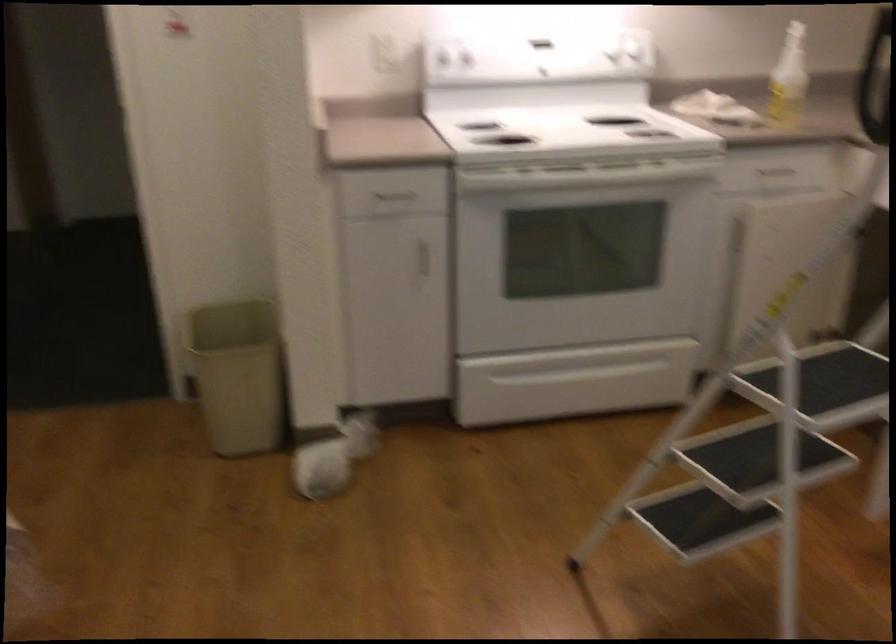
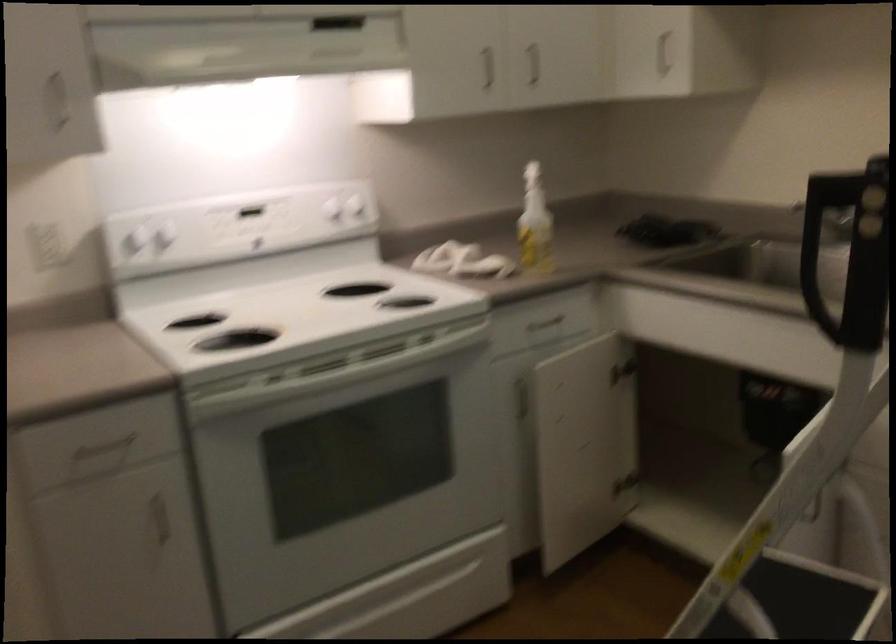
The point at (599, 375) is marked in the first image. Where is the corresponding point in the second image?

(409, 596)